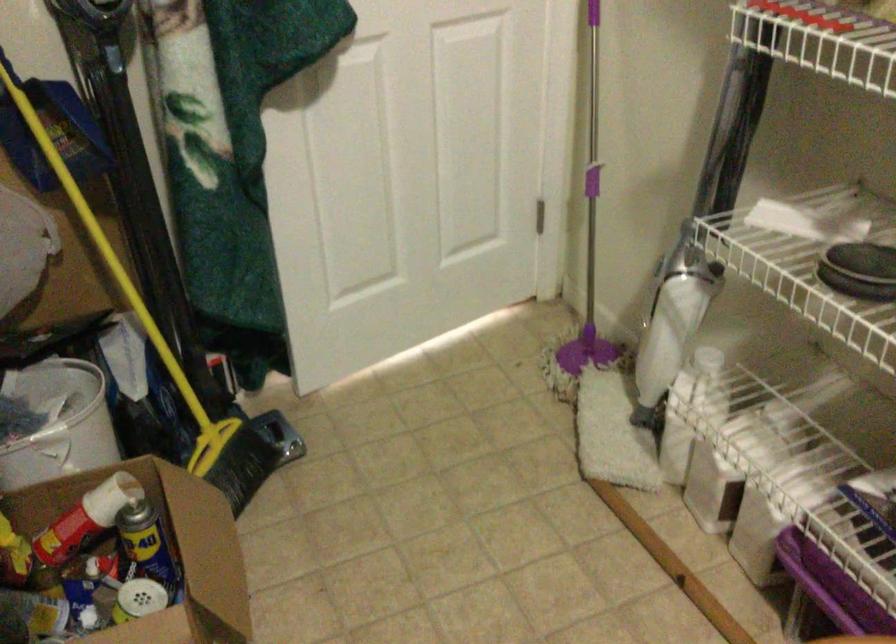
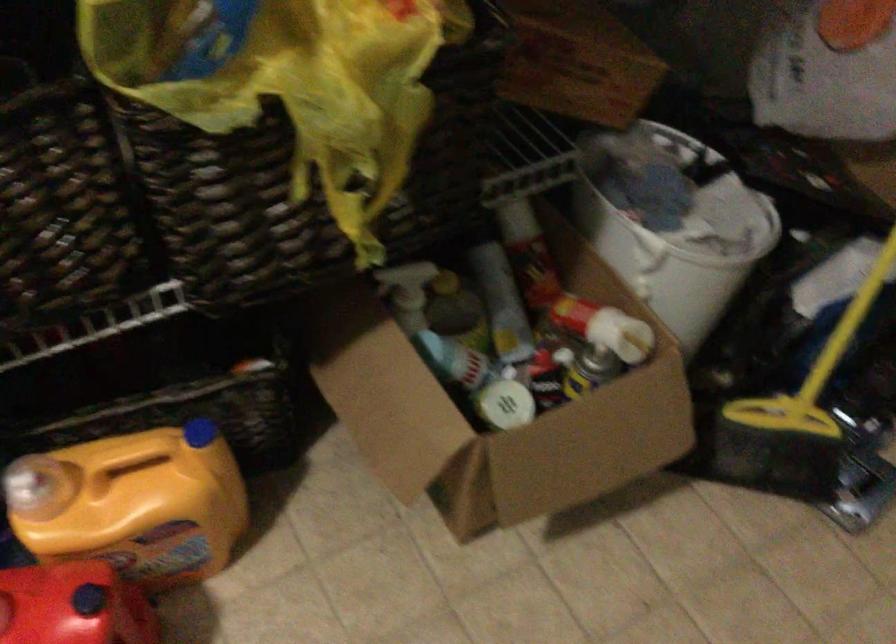
Where in the second image is the point corresponding to pixel 92 509 from the first image?

(595, 319)